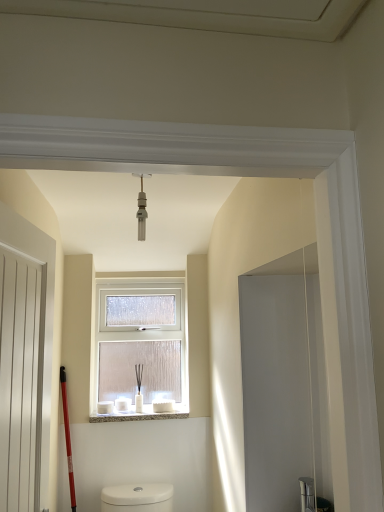
Question: From a real-world perspective, is clear frosted glass window at center physically located above or below white wooden screen door at left?

Choices:
 (A) below
 (B) above

Answer: (B)

Question: Considering their positions, is clear frosted glass window at center located in front of or behind white wooden screen door at left?

Choices:
 (A) front
 (B) behind

Answer: (B)

Question: Considering the real-world distances, which object is farthest from the white wooden screen door at left?

Choices:
 (A) clear frosted glass window at center
 (B) matte silver light fixture at center
 (C) white textured stone at center

Answer: (A)

Question: Which of these objects is positioned farthest from the matte silver light fixture at center?

Choices:
 (A) white wooden screen door at left
 (B) clear frosted glass window at center
 (C) white textured stone at center

Answer: (C)